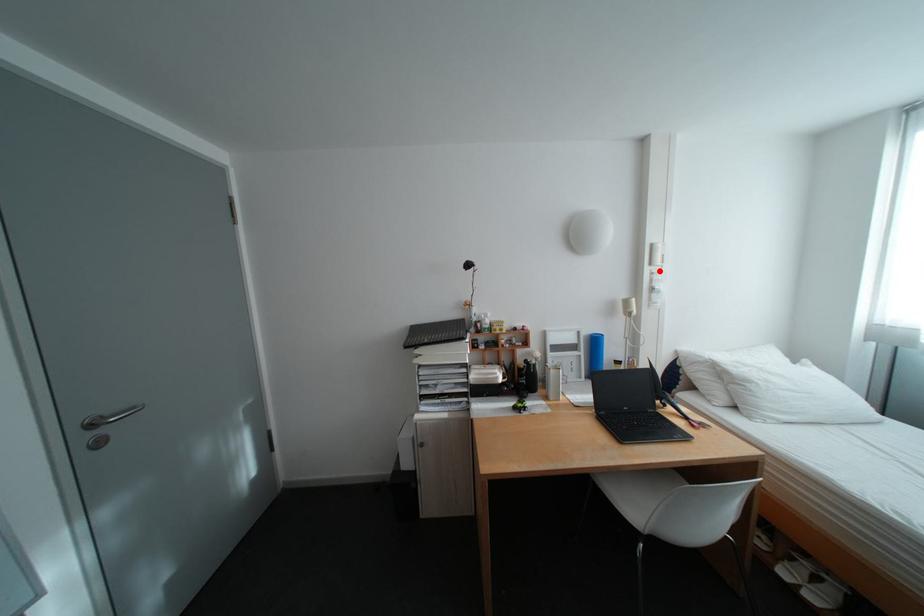
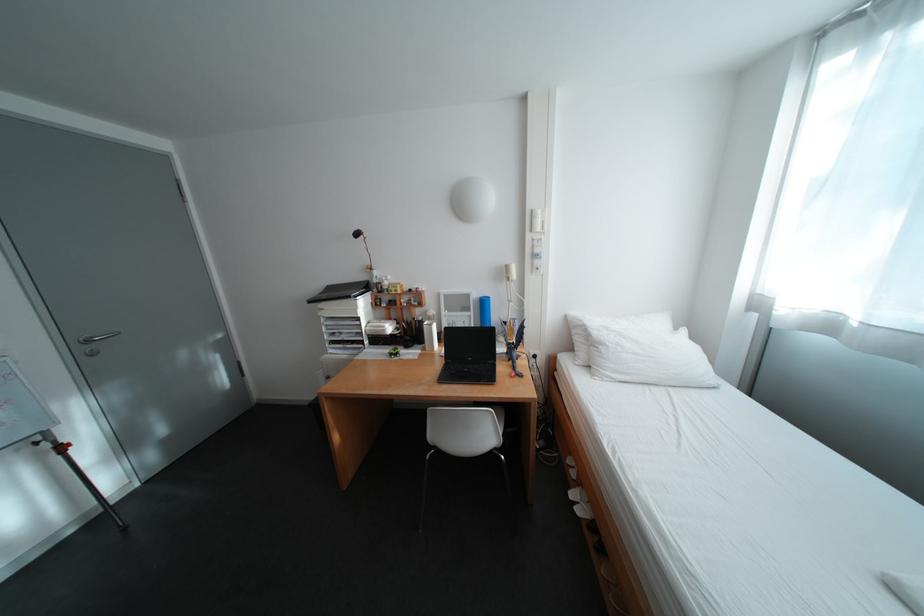
The point at the highlighted location is marked in the first image. Where is the corresponding point in the second image?

(541, 237)